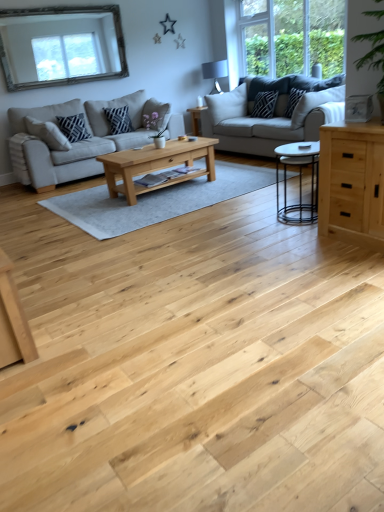
Question: From the image's perspective, would you say matte black pillow at center-left, the third pillow viewed from the right, is positioned over matte black lampshade at upper center?

Choices:
 (A) yes
 (B) no

Answer: (B)

Question: Can you confirm if matte black pillow at center-left, the third pillow viewed from the right, is smaller than matte black lampshade at upper center?

Choices:
 (A) no
 (B) yes

Answer: (B)

Question: Considering the relative sizes of matte black pillow at center-left, which ranks as the second pillow in left-to-right order, and matte black lampshade at upper center in the image provided, is matte black pillow at center-left, which ranks as the second pillow in left-to-right order, thinner than matte black lampshade at upper center?

Choices:
 (A) no
 (B) yes

Answer: (B)

Question: Is matte black pillow at center-left, which ranks as the second pillow in left-to-right order, beside matte black lampshade at upper center?

Choices:
 (A) no
 (B) yes

Answer: (A)

Question: Does matte black pillow at center-left, the third pillow viewed from the right, appear on the left side of matte black lampshade at upper center?

Choices:
 (A) no
 (B) yes

Answer: (B)

Question: From a real-world perspective, is matte black pillow at center-left, which ranks as the second pillow in left-to-right order, located beneath matte black lampshade at upper center?

Choices:
 (A) yes
 (B) no

Answer: (A)

Question: Considering the relative sizes of light gray fabric couch at left, the second studio couch when ordered from right to left, and black metal coffee table at center, which is the first coffee table from front to back, in the image provided, is light gray fabric couch at left, the second studio couch when ordered from right to left, wider than black metal coffee table at center, which is the first coffee table from front to back,?

Choices:
 (A) yes
 (B) no

Answer: (A)

Question: Does light gray fabric couch at left, the second studio couch when ordered from right to left, lie in front of black metal coffee table at center, which is the first coffee table from front to back?

Choices:
 (A) no
 (B) yes

Answer: (A)

Question: Can you confirm if light gray fabric couch at left, the second studio couch when ordered from right to left, is thinner than black metal coffee table at center, the 1th coffee table in the right-to-left sequence?

Choices:
 (A) no
 (B) yes

Answer: (A)

Question: Does light gray fabric couch at left, the second studio couch when ordered from right to left, have a greater height compared to black metal coffee table at center, the 1th coffee table in the right-to-left sequence?

Choices:
 (A) yes
 (B) no

Answer: (A)

Question: Does light gray fabric couch at left, the second studio couch when ordered from right to left, have a smaller size compared to black metal coffee table at center, which is the first coffee table from front to back?

Choices:
 (A) yes
 (B) no

Answer: (B)

Question: Is light gray fabric couch at left, marked as the first studio couch in a left-to-right arrangement, completely or partially outside of black metal coffee table at center, positioned as the second coffee table in left-to-right order?

Choices:
 (A) yes
 (B) no

Answer: (A)

Question: Does light gray fabric couch at left, the second studio couch when ordered from right to left, come in front of light gray fabric couch at center, which appears as the second studio couch when viewed from the left?

Choices:
 (A) yes
 (B) no

Answer: (B)